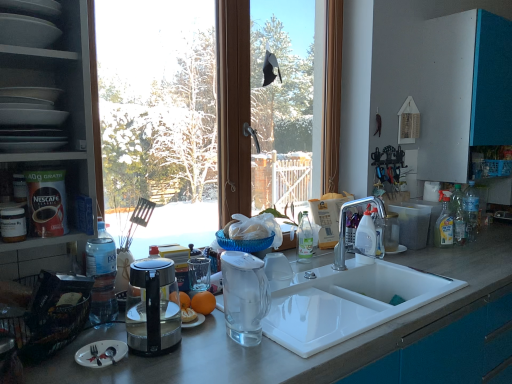
Find the location of a particular element. free space to the left of transparent glass blender at sink is located at coordinates (208, 336).